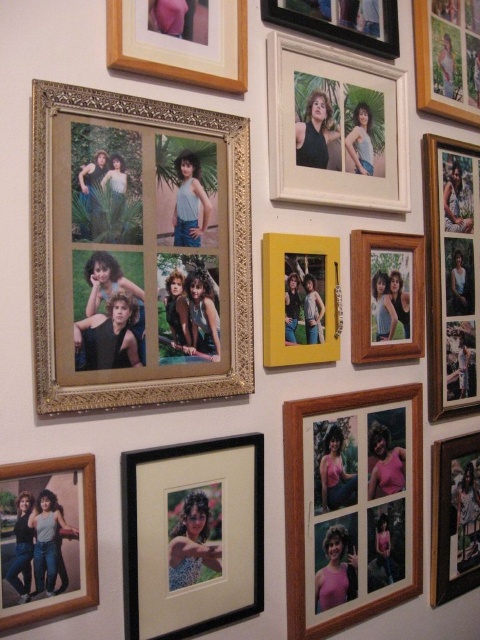
From the picture: You are standing in front of a wall with many photo frames. There is a point at coordinates (386,296). Which object is this point located on?

The point at coordinates (386,296) is located on the wooden photo frame at center right.

You are hanging a new picture on the wall and want to ensure it doesn not block the view of the black matte photo frame at lower center and the wooden photo frame at right. Since you want the new picture to be visible from where you are standing, which of the two existing frames should you place it in front of?

You should place the new picture in front of the wooden photo frame at right because the black matte photo frame at lower center is closer to the viewer, so placing the new picture in front of it would block its view. The wooden photo frame at right is further away, so placing the new picture in front of it would still allow both frames to be visible.